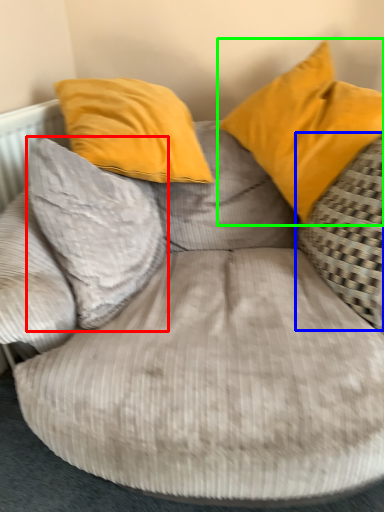
Question: Considering the real-world distances, which object is farthest from pillow (highlighted by a red box)? pillow (highlighted by a blue box) or pillow (highlighted by a green box)?

Choices:
 (A) pillow
 (B) pillow

Answer: (A)